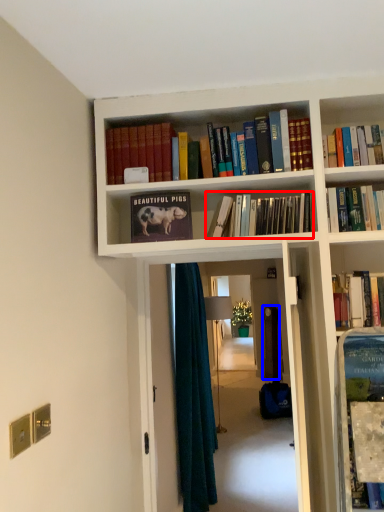
Question: Which object is further to the camera taking this photo, book (highlighted by a red box) or door (highlighted by a blue box)?

Choices:
 (A) book
 (B) door

Answer: (B)